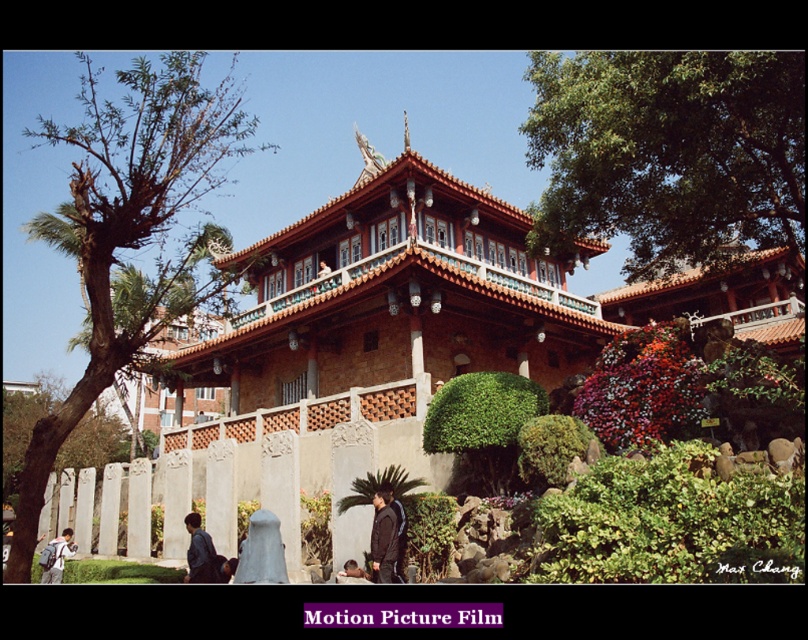
Question: Where is brown stone palace at center located in relation to light blue denim jacket at lower left in the image?

Choices:
 (A) above
 (B) below

Answer: (A)

Question: Among these objects, which one is nearest to the camera?

Choices:
 (A) brown stone palace at center
 (B) smooth skin face at lower center
 (C) dark blue jacket at lower left

Answer: (B)

Question: Does dark brown leather jacket at center appear on the right side of dark blue jacket at lower left?

Choices:
 (A) no
 (B) yes

Answer: (B)

Question: Which point is closer to the camera taking this photo?

Choices:
 (A) coord(364,573)
 (B) coord(371,528)
 (C) coord(331,221)

Answer: (A)

Question: Can you confirm if brown stone palace at center is bigger than dark brown leather jacket at center?

Choices:
 (A) no
 (B) yes

Answer: (B)

Question: Which point appears farthest from the camera in this image?

Choices:
 (A) (204, 577)
 (B) (396, 518)

Answer: (A)